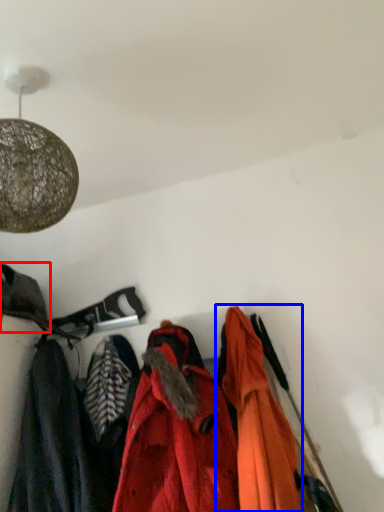
Question: Among these objects, which one is nearest to the camera, cloak (highlighted by a red box) or jacket (highlighted by a blue box)?

Choices:
 (A) cloak
 (B) jacket

Answer: (B)